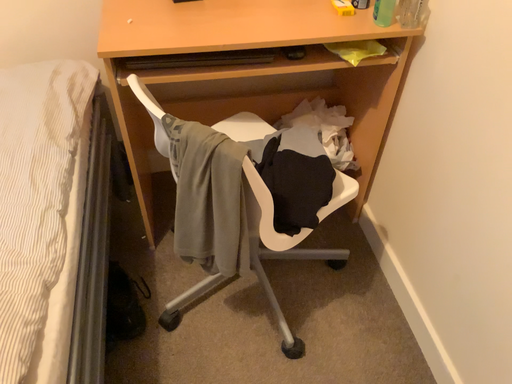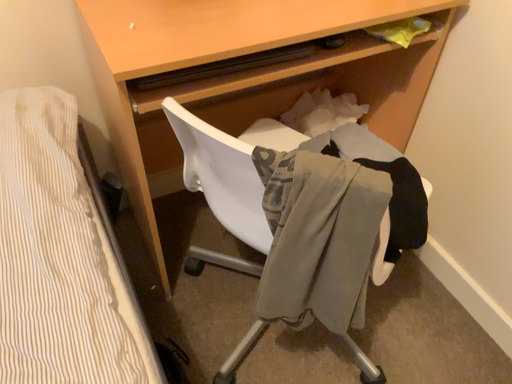
Question: How did the camera likely rotate when shooting the video?

Choices:
 (A) rotated right
 (B) rotated left

Answer: (A)